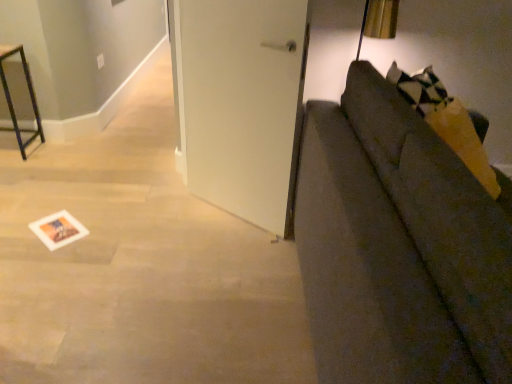
Where is `vacant space that is to the left of white paper postcard at lower left`? This screenshot has height=384, width=512. vacant space that is to the left of white paper postcard at lower left is located at coordinates (23, 227).